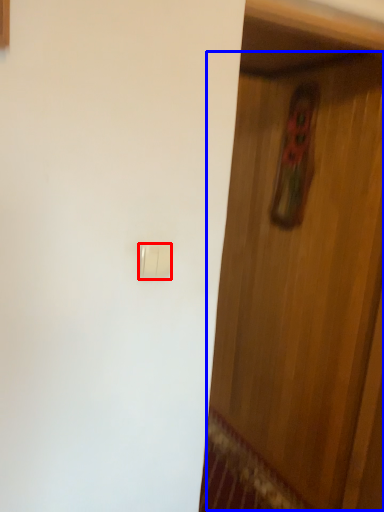
Question: Which point is closer to the camera, light switch (highlighted by a red box) or door (highlighted by a blue box)?

Choices:
 (A) light switch
 (B) door

Answer: (A)